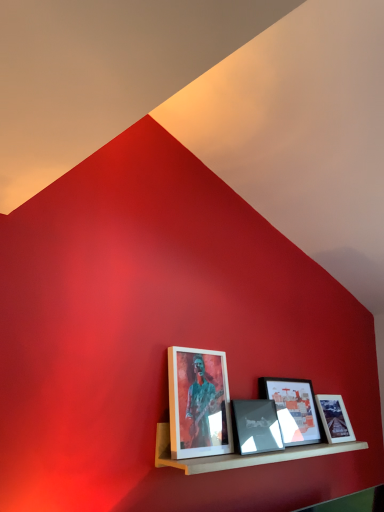
What do you see at coordinates (256, 426) in the screenshot? The height and width of the screenshot is (512, 384). I see `matte black picture frame at center, the third picture frame in the right-to-left sequence` at bounding box center [256, 426].

The height and width of the screenshot is (512, 384). In order to click on matte black picture frame at center, the second picture frame from the right in this screenshot , I will do `click(294, 409)`.

Locate an element on the screen. matte white picture frame at center, which appears as the 1th picture frame when viewed from the left is located at coordinates (198, 403).

What do you see at coordinates (335, 418) in the screenshot? I see `matte glass picture frame at center, which is the first picture frame from right to left` at bounding box center [335, 418].

Image resolution: width=384 pixels, height=512 pixels. Identify the location of matte black picture frame at center, the third picture frame in the right-to-left sequence. click(x=256, y=426).

This screenshot has height=512, width=384. In order to click on picture frame that is the 3rd object directly below the matte white picture frame at center, which appears as the 1th picture frame when viewed from the left (from a real-world perspective) in this screenshot , I will do `click(256, 426)`.

From a real-world perspective, which is physically above, matte white picture frame at center, which is the fourth picture frame in right-to-left order, or matte black picture frame at center, the third picture frame in the right-to-left sequence?

From a 3D spatial view, matte white picture frame at center, which is the fourth picture frame in right-to-left order, is above.

Is there a large distance between matte white picture frame at center, which is the fourth picture frame in right-to-left order, and matte black picture frame at center, the 2th picture frame viewed from the left?

matte white picture frame at center, which is the fourth picture frame in right-to-left order, is near matte black picture frame at center, the 2th picture frame viewed from the left, not far away.

In the scene shown: Which is more to the left, matte glass picture frame at center, placed as the fourth picture frame when sorted from left to right, or matte white picture frame at center, which appears as the 1th picture frame when viewed from the left?

From the viewer's perspective, matte white picture frame at center, which appears as the 1th picture frame when viewed from the left, appears more on the left side.

Is matte glass picture frame at center, placed as the fourth picture frame when sorted from left to right, situated inside matte white picture frame at center, which appears as the 1th picture frame when viewed from the left, or outside?

matte glass picture frame at center, placed as the fourth picture frame when sorted from left to right, cannot be found inside matte white picture frame at center, which appears as the 1th picture frame when viewed from the left.

Is matte glass picture frame at center, which is the first picture frame from right to left, facing away from matte white picture frame at center, which appears as the 1th picture frame when viewed from the left?

That's not correct — matte glass picture frame at center, which is the first picture frame from right to left, is not looking away from matte white picture frame at center, which appears as the 1th picture frame when viewed from the left.

Is matte glass picture frame at center, which is the first picture frame from right to left, thinner than matte white picture frame at center, which appears as the 1th picture frame when viewed from the left?

No, matte glass picture frame at center, which is the first picture frame from right to left, is not thinner than matte white picture frame at center, which appears as the 1th picture frame when viewed from the left.

From the picture: From the image's perspective, is matte black picture frame at center, which is counted as the 3th picture frame, starting from the left, on matte white picture frame at center, which appears as the 1th picture frame when viewed from the left?

Actually, matte black picture frame at center, which is counted as the 3th picture frame, starting from the left, appears below matte white picture frame at center, which appears as the 1th picture frame when viewed from the left, in the image.

Is matte black picture frame at center, the second picture frame from the right, closer to camera compared to matte white picture frame at center, which is the fourth picture frame in right-to-left order?

No, it is not.

Is the surface of matte black picture frame at center, which is counted as the 3th picture frame, starting from the left, in direct contact with matte white picture frame at center, which appears as the 1th picture frame when viewed from the left?

No, matte black picture frame at center, which is counted as the 3th picture frame, starting from the left, is not beside matte white picture frame at center, which appears as the 1th picture frame when viewed from the left.

Between matte white picture frame at center, which is the fourth picture frame in right-to-left order, and wooden shelf at lower center, which one has less height?

wooden shelf at lower center is shorter.

From the image's perspective, is matte white picture frame at center, which appears as the 1th picture frame when viewed from the left, positioned above or below wooden shelf at lower center?

Based on their image positions, matte white picture frame at center, which appears as the 1th picture frame when viewed from the left, is located above wooden shelf at lower center.

From a real-world perspective, who is located lower, matte white picture frame at center, which is the fourth picture frame in right-to-left order, or wooden shelf at lower center?

From a 3D spatial view, wooden shelf at lower center is below.

Considering the sizes of objects matte black picture frame at center, the third picture frame in the right-to-left sequence, and matte glass picture frame at center, which is the first picture frame from right to left, in the image provided, who is wider, matte black picture frame at center, the third picture frame in the right-to-left sequence, or matte glass picture frame at center, which is the first picture frame from right to left,?

With larger width is matte glass picture frame at center, which is the first picture frame from right to left.

Is point (244, 436) farther from viewer compared to point (350, 438)?

No.

Considering the sizes of objects matte black picture frame at center, the 2th picture frame viewed from the left, and matte glass picture frame at center, which is the first picture frame from right to left, in the image provided, who is smaller, matte black picture frame at center, the 2th picture frame viewed from the left, or matte glass picture frame at center, which is the first picture frame from right to left,?

matte black picture frame at center, the 2th picture frame viewed from the left.

Is matte black picture frame at center, the 2th picture frame viewed from the left, looking in the opposite direction of matte glass picture frame at center, placed as the fourth picture frame when sorted from left to right?

matte black picture frame at center, the 2th picture frame viewed from the left, does not have its back to matte glass picture frame at center, placed as the fourth picture frame when sorted from left to right.

Who is taller, matte black picture frame at center, the 2th picture frame viewed from the left, or matte black picture frame at center, which is counted as the 3th picture frame, starting from the left?

Standing taller between the two is matte black picture frame at center, which is counted as the 3th picture frame, starting from the left.

Can you tell me how much matte black picture frame at center, the 2th picture frame viewed from the left, and matte black picture frame at center, which is counted as the 3th picture frame, starting from the left, differ in facing direction?

3.16 degrees.

Does matte black picture frame at center, the third picture frame in the right-to-left sequence, come behind matte black picture frame at center, the second picture frame from the right?

No, it is not.

Considering the sizes of matte black picture frame at center, the third picture frame in the right-to-left sequence, and matte black picture frame at center, the second picture frame from the right, in the image, is matte black picture frame at center, the third picture frame in the right-to-left sequence, wider or thinner than matte black picture frame at center, the second picture frame from the right,?

matte black picture frame at center, the third picture frame in the right-to-left sequence, is thinner than matte black picture frame at center, the second picture frame from the right.

Is matte black picture frame at center, which is counted as the 3th picture frame, starting from the left, oriented away from matte black picture frame at center, the third picture frame in the right-to-left sequence?

No, matte black picture frame at center, which is counted as the 3th picture frame, starting from the left,'s orientation is not away from matte black picture frame at center, the third picture frame in the right-to-left sequence.

Can you tell me how much matte black picture frame at center, which is counted as the 3th picture frame, starting from the left, and matte black picture frame at center, the 2th picture frame viewed from the left, differ in facing direction?

3.16 degrees separate the facing orientations of matte black picture frame at center, which is counted as the 3th picture frame, starting from the left, and matte black picture frame at center, the 2th picture frame viewed from the left.

From a real-world perspective, starting from the matte black picture frame at center, which is counted as the 3th picture frame, starting from the left, which picture frame is the 2nd one below it? Please provide its 2D coordinates.

[(256, 426)]

Is point (260, 393) closer or farther from the camera than point (271, 400)?

Clearly, point (260, 393) is more distant from the camera than point (271, 400).

The image size is (384, 512). In the image, there is a matte black picture frame at center, the third picture frame in the right-to-left sequence. What are the coordinates of `picture frame above it (from the image's perspective)` in the screenshot? It's located at (198, 403).

Find the location of a particular element. The image size is (384, 512). the 3rd picture frame counting from the right of the matte white picture frame at center, which is the fourth picture frame in right-to-left order is located at coordinates (335, 418).

From the image, which object appears to be farther from matte black picture frame at center, which is counted as the 3th picture frame, starting from the left, matte white picture frame at center, which appears as the 1th picture frame when viewed from the left, or matte glass picture frame at center, placed as the fourth picture frame when sorted from left to right?

Among the two, matte white picture frame at center, which appears as the 1th picture frame when viewed from the left, is located further to matte black picture frame at center, which is counted as the 3th picture frame, starting from the left.

When comparing their distances from matte white picture frame at center, which appears as the 1th picture frame when viewed from the left, does wooden shelf at lower center or matte black picture frame at center, the third picture frame in the right-to-left sequence, seem closer?

matte black picture frame at center, the third picture frame in the right-to-left sequence, is closer to matte white picture frame at center, which appears as the 1th picture frame when viewed from the left.

Estimate the real-world distances between objects in this image. Which object is further from matte black picture frame at center, the second picture frame from the right, matte black picture frame at center, the 2th picture frame viewed from the left, or matte glass picture frame at center, which is the first picture frame from right to left?

matte glass picture frame at center, which is the first picture frame from right to left.

Looking at this image, when comparing their distances from matte black picture frame at center, the third picture frame in the right-to-left sequence, does matte glass picture frame at center, which is the first picture frame from right to left, or wooden shelf at lower center seem further?

The object further to matte black picture frame at center, the third picture frame in the right-to-left sequence, is matte glass picture frame at center, which is the first picture frame from right to left.

Considering their positions, is matte white picture frame at center, which appears as the 1th picture frame when viewed from the left, positioned closer to matte black picture frame at center, which is counted as the 3th picture frame, starting from the left, than wooden shelf at lower center?

wooden shelf at lower center.

Looking at the image, which one is located further to matte black picture frame at center, which is counted as the 3th picture frame, starting from the left, matte white picture frame at center, which is the fourth picture frame in right-to-left order, or matte black picture frame at center, the 2th picture frame viewed from the left?

matte white picture frame at center, which is the fourth picture frame in right-to-left order, is positioned further to the anchor matte black picture frame at center, which is counted as the 3th picture frame, starting from the left.

Considering their positions, is matte black picture frame at center, the 2th picture frame viewed from the left, positioned further to matte black picture frame at center, the second picture frame from the right, than matte white picture frame at center, which is the fourth picture frame in right-to-left order?

matte white picture frame at center, which is the fourth picture frame in right-to-left order, is further to matte black picture frame at center, the second picture frame from the right.

Looking at the image, which one is located closer to matte white picture frame at center, which appears as the 1th picture frame when viewed from the left, matte black picture frame at center, which is counted as the 3th picture frame, starting from the left, or wooden shelf at lower center?

wooden shelf at lower center.

The width and height of the screenshot is (384, 512). What are the coordinates of `picture frame between matte black picture frame at center, the third picture frame in the right-to-left sequence, and matte glass picture frame at center, placed as the fourth picture frame when sorted from left to right` in the screenshot? It's located at (294, 409).

Find the location of a particular element. picture frame located between matte white picture frame at center, which appears as the 1th picture frame when viewed from the left, and wooden shelf at lower center in the left-right direction is located at coordinates (256, 426).

I want to click on picture frame between matte white picture frame at center, which appears as the 1th picture frame when viewed from the left, and matte black picture frame at center, which is counted as the 3th picture frame, starting from the left, from left to right, so click(256, 426).